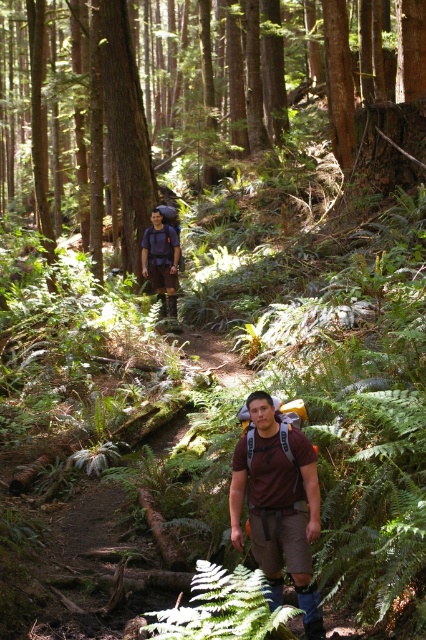
Question: Which point appears closest to the camera in this image?

Choices:
 (A) (112, 112)
 (B) (203, 611)

Answer: (B)

Question: Is brown wood tree at upper center below green leafy fern at center?

Choices:
 (A) no
 (B) yes

Answer: (A)

Question: Does brown fabric backpack at center have a larger size compared to smooth brown tree trunk at upper center?

Choices:
 (A) no
 (B) yes

Answer: (A)

Question: Which point is closer to the camera?

Choices:
 (A) pos(271,573)
 (B) pos(241,625)

Answer: (B)

Question: Which object is positioned farthest from the brown fabric backpack at center?

Choices:
 (A) green leafy fern at center
 (B) smooth brown tree trunk at upper center

Answer: (B)

Question: From the image, what is the correct spatial relationship of brown wood tree at upper center in relation to brown fabric backpack at center?

Choices:
 (A) below
 (B) above

Answer: (B)